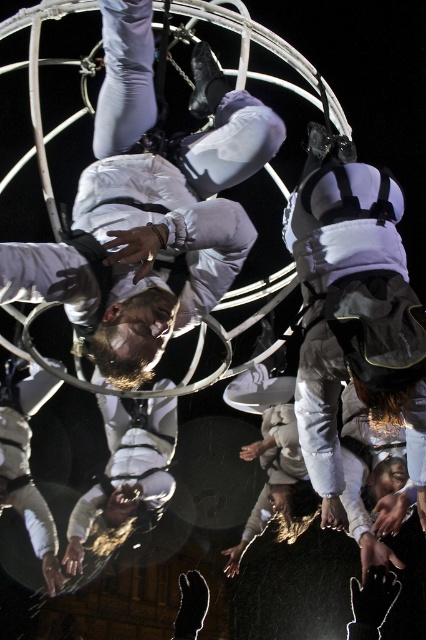
Is white matte astronaut at center positioned before matte white astronaut at center?

Yes, white matte astronaut at center is in front of matte white astronaut at center.

Between point (117, 109) and point (123, 477), which one is positioned behind?

The point (123, 477) is more distant.

Who is more forward, (137, 35) or (77, 544)?

Point (137, 35)

Identify the location of white matte astronaut at center. The height and width of the screenshot is (640, 426). (124, 76).